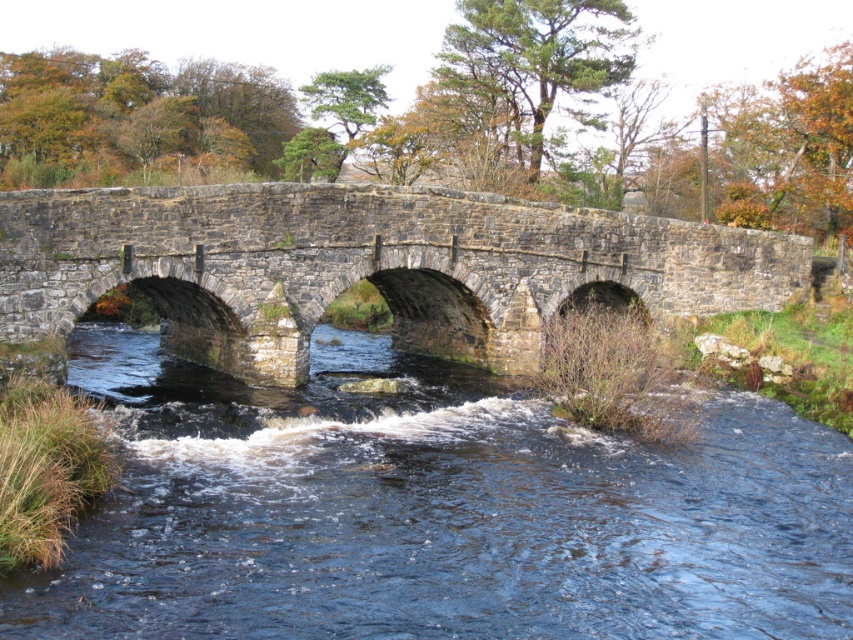
Question: Can you confirm if dark blue water at center is positioned above stone bridge at center?

Choices:
 (A) no
 (B) yes

Answer: (A)

Question: Which point appears closest to the camera in this image?

Choices:
 (A) (398, 266)
 (B) (317, 561)

Answer: (B)

Question: Is dark blue water at center above stone bridge at center?

Choices:
 (A) no
 (B) yes

Answer: (A)

Question: Which point appears closest to the camera in this image?

Choices:
 (A) 724,310
 (B) 419,598

Answer: (B)

Question: Is dark blue water at center to the left of stone bridge at center from the viewer's perspective?

Choices:
 (A) yes
 (B) no

Answer: (A)

Question: Among these objects, which one is nearest to the camera?

Choices:
 (A) dark blue water at center
 (B) stone bridge at center

Answer: (A)